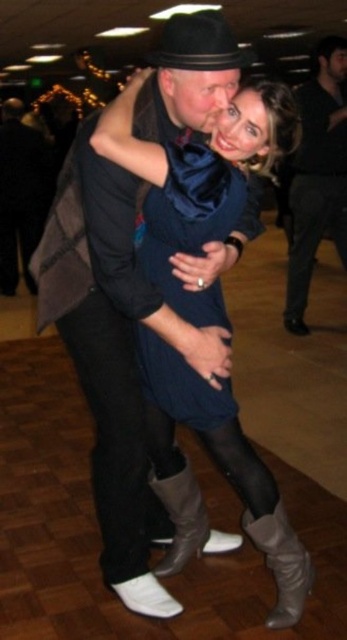
Does black felt fedora at upper center appear on the left side of silver metallic boot at lower center?

Correct, you'll find black felt fedora at upper center to the left of silver metallic boot at lower center.

Between black felt fedora at upper center and silver metallic boot at lower center, which one is positioned lower?

silver metallic boot at lower center

Does point (224, 45) come in front of point (286, 600)?

Yes, point (224, 45) is closer to viewer.

I want to click on black felt fedora at upper center, so click(198, 44).

At what (x,y) coordinates should I click in order to perform the action: click on velvet blue dress at center. Please return your answer as a coordinate pair (x, y). Image resolution: width=347 pixels, height=640 pixels. Looking at the image, I should click on (190, 225).

This screenshot has height=640, width=347. What do you see at coordinates (190, 225) in the screenshot?
I see `velvet blue dress at center` at bounding box center [190, 225].

Is point (147, 244) positioned after point (195, 26)?

Yes, it is.

I want to click on velvet blue dress at center, so click(190, 225).

Between point (181, 166) and point (333, 236), which one is positioned behind?

Point (333, 236)

Does point (214, 228) come behind point (345, 93)?

No, it is in front of (345, 93).

Is point (180, 225) in front of point (297, 186)?

Yes, point (180, 225) is in front of point (297, 186).

This screenshot has width=347, height=640. In order to click on velvet blue dress at center in this screenshot , I will do `click(190, 225)`.